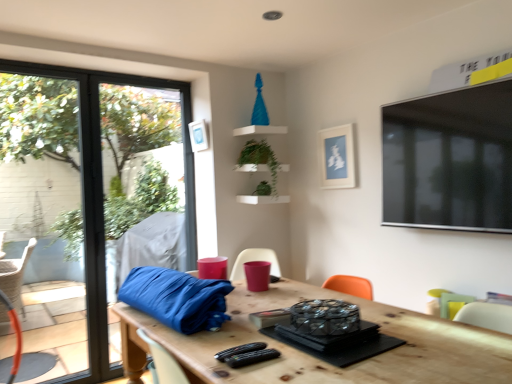
Question: Is point (443, 311) closer or farther from the camera than point (325, 162)?

Choices:
 (A) farther
 (B) closer

Answer: (B)

Question: Relative to white matte picture frame at upper center, the second picture frame in the left-to-right sequence, is pastel green fabric armchair at lower right, the 1th armchair when ordered from right to left, in front or behind?

Choices:
 (A) behind
 (B) front

Answer: (B)

Question: Estimate the real-world distances between objects in this image. Which object is farther from the white matte picture frame at upper center, positioned as the second picture frame in right-to-left order?

Choices:
 (A) pastel green fabric armchair at lower right, the 1th armchair ordered from the bottom
 (B) white matte picture frame at upper center, the second picture frame in the left-to-right sequence
 (C) matte pink cup at center, which is the 2th armchair from right to left
 (D) green matte plant at upper center, which appears as the 2th plant when ordered from the bottom
 (E) wooden table at center

Answer: (A)

Question: Based on their relative distances, which object is nearer to the white matte picture frame at upper center, the second picture frame in the left-to-right sequence?

Choices:
 (A) white matte picture frame at upper center, positioned as the second picture frame in right-to-left order
 (B) transparent glass window at left
 (C) matte pink cup at center, positioned as the 2th armchair in bottom-to-top order
 (D) pastel green fabric armchair at lower right, which ranks as the 2th armchair in top-to-bottom order
 (E) green leafy plant at upper center, which is the 1th plant in bottom-to-top order

Answer: (E)